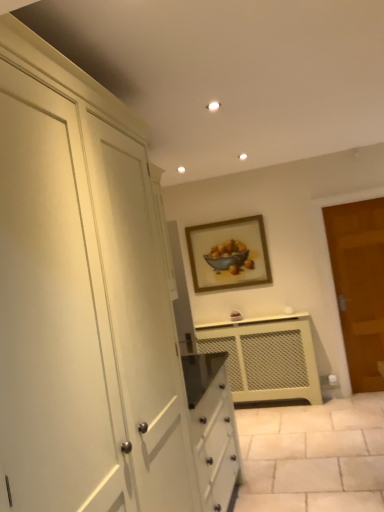
Question: Should I look upward or downward to see brown wooden door at right?

Choices:
 (A) up
 (B) down

Answer: (B)

Question: Can you confirm if wooden-framed painting at center is taller than brown wooden door at right?

Choices:
 (A) no
 (B) yes

Answer: (A)

Question: From a real-world perspective, is wooden-framed painting at center located higher than brown wooden door at right?

Choices:
 (A) no
 (B) yes

Answer: (B)

Question: Considering the relative sizes of wooden-framed painting at center and brown wooden door at right in the image provided, is wooden-framed painting at center shorter than brown wooden door at right?

Choices:
 (A) no
 (B) yes

Answer: (B)

Question: Would you say wooden-framed painting at center is a long distance from brown wooden door at right?

Choices:
 (A) no
 (B) yes

Answer: (B)

Question: Is wooden-framed painting at center positioned before brown wooden door at right?

Choices:
 (A) yes
 (B) no

Answer: (B)

Question: Is wooden-framed painting at center bigger than brown wooden door at right?

Choices:
 (A) yes
 (B) no

Answer: (B)

Question: Is brown wooden door at right at the back of matte cream radiator at center?

Choices:
 (A) no
 (B) yes

Answer: (A)

Question: Considering the relative sizes of matte cream radiator at center and brown wooden door at right in the image provided, is matte cream radiator at center thinner than brown wooden door at right?

Choices:
 (A) no
 (B) yes

Answer: (A)

Question: From the image's perspective, is matte cream radiator at center located above brown wooden door at right?

Choices:
 (A) yes
 (B) no

Answer: (B)

Question: Considering the relative sizes of matte cream radiator at center and brown wooden door at right in the image provided, is matte cream radiator at center bigger than brown wooden door at right?

Choices:
 (A) yes
 (B) no

Answer: (A)

Question: Is matte cream radiator at center located outside brown wooden door at right?

Choices:
 (A) yes
 (B) no

Answer: (A)

Question: Could you tell me if matte cream radiator at center is turned towards brown wooden door at right?

Choices:
 (A) no
 (B) yes

Answer: (A)

Question: Is wooden-framed painting at center located outside matte cream radiator at center?

Choices:
 (A) no
 (B) yes

Answer: (B)